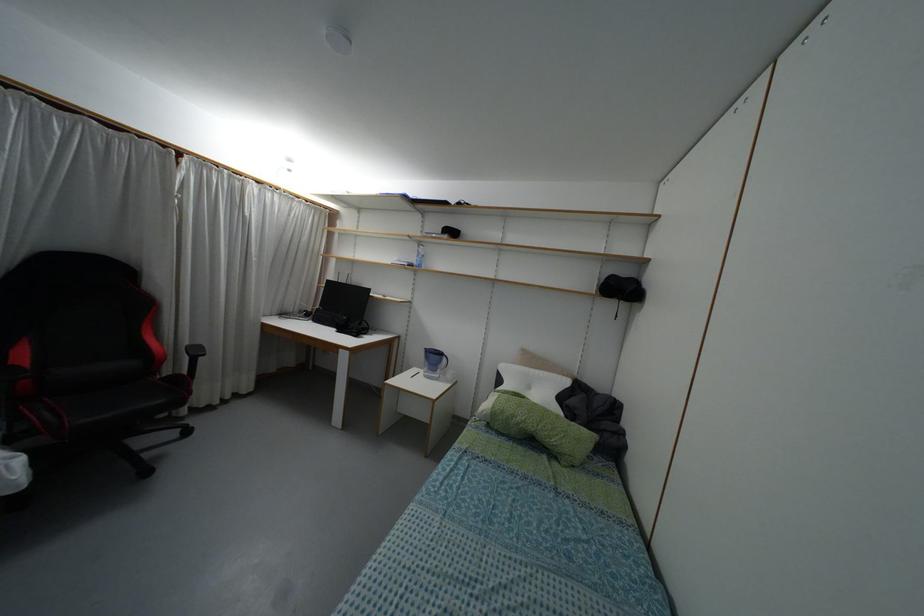
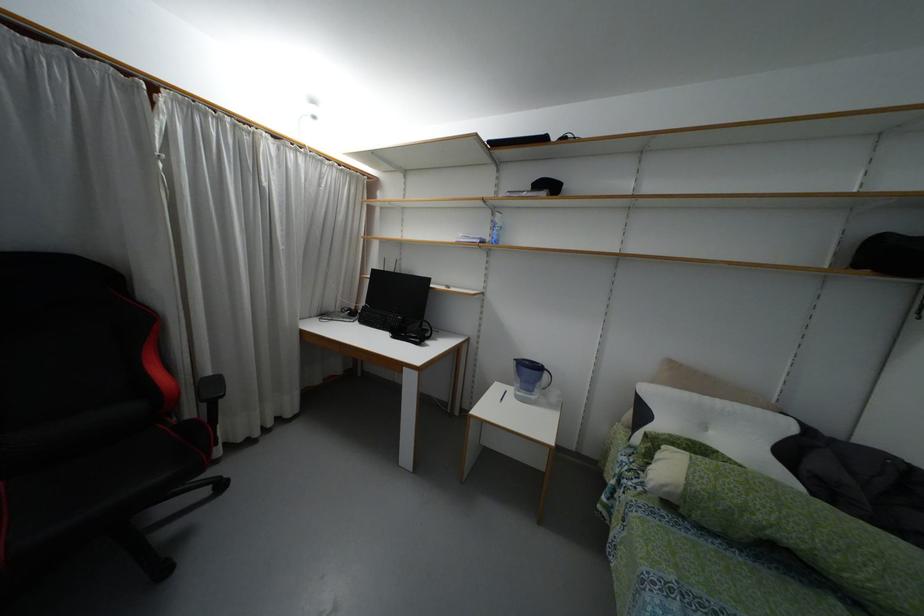
In the second image, find the point that corresponds to point 419,243 in the first image.

(493, 209)